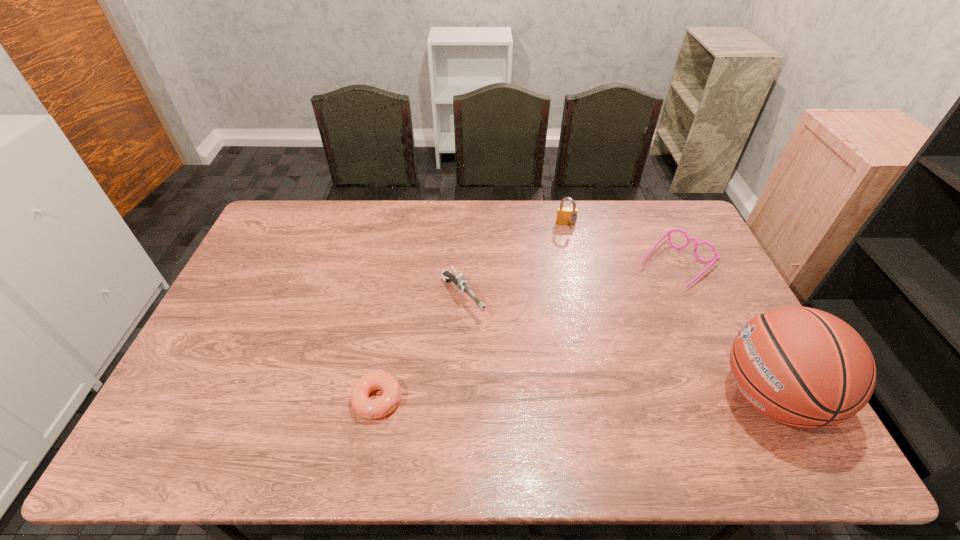
Where is `the leftmost object`? The height and width of the screenshot is (540, 960). the leftmost object is located at coordinates (368, 408).

The image size is (960, 540). What are the coordinates of `doughnut` in the screenshot? It's located at (368, 408).

Identify the location of the tallest object. (803, 367).

At what (x,y) coordinates should I click in order to perform the action: click on the farthest object. Please return your answer as a coordinate pair (x, y). Looking at the image, I should click on (565, 216).

Where is `the third object from right to left`? Image resolution: width=960 pixels, height=540 pixels. the third object from right to left is located at coordinates (565, 216).

The image size is (960, 540). In order to click on gun in this screenshot , I will do `click(459, 281)`.

Locate an element on the screen. the third shortest object is located at coordinates (459, 281).

This screenshot has height=540, width=960. In order to click on spectacles in this screenshot , I will do `click(716, 257)`.

Locate an element on the screen. Image resolution: width=960 pixels, height=540 pixels. free region located 0.370m on the back of the shortest object is located at coordinates 399,279.

Locate an element on the screen. The image size is (960, 540). free space located 0.150m on the logo side of the basketball is located at coordinates (659, 396).